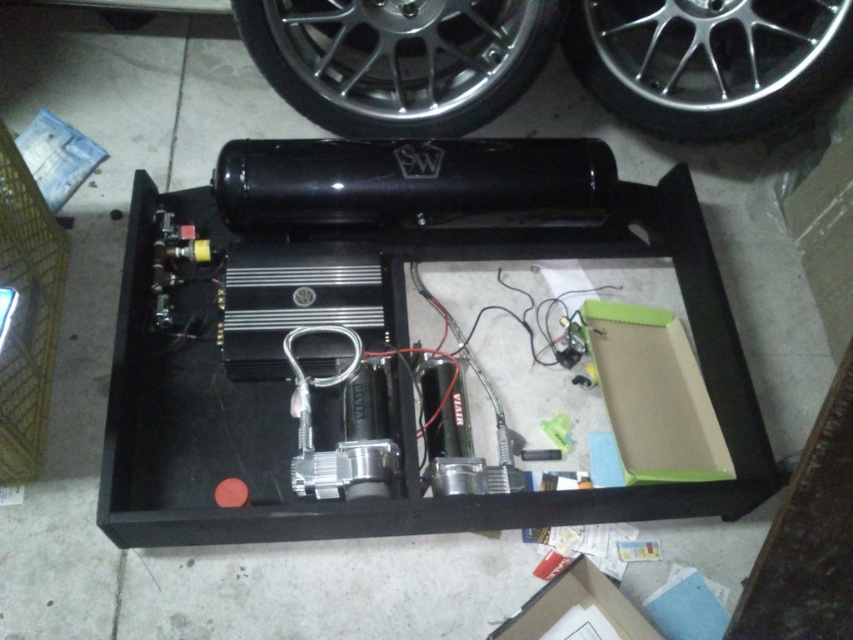
You are an automotive technician examining the contents of an open toolbox. You notice two wheels inside the toolbox labeled as the silver metallic wheel at upper center and the chrome metallic wheel at upper center. Which of these wheels is shorter in height?

The silver metallic wheel at upper center is not as tall as the chrome metallic wheel at upper center, so the silver metallic wheel at upper center is shorter in height.

You are an automotive technician working on a car. You need to choose between the silver metallic wheel at upper center and the chrome metallic wheel at upper center for a vehicle that requires a wider wheel. Which wheel should you select?

The silver metallic wheel at upper center has a larger width than the chrome metallic wheel at upper center, so you should select the silver metallic wheel at upper center for the vehicle that requires a wider wheel.

Consider the image. You are an automotive technician working on a car. You need to locate the silver metallic wheel at upper center and the chrome metallic wheel at upper center inside the open toolbox. According to the image, which wheel is positioned to the left of the other?

The silver metallic wheel at upper center is to the left of the chrome metallic wheel at upper center.